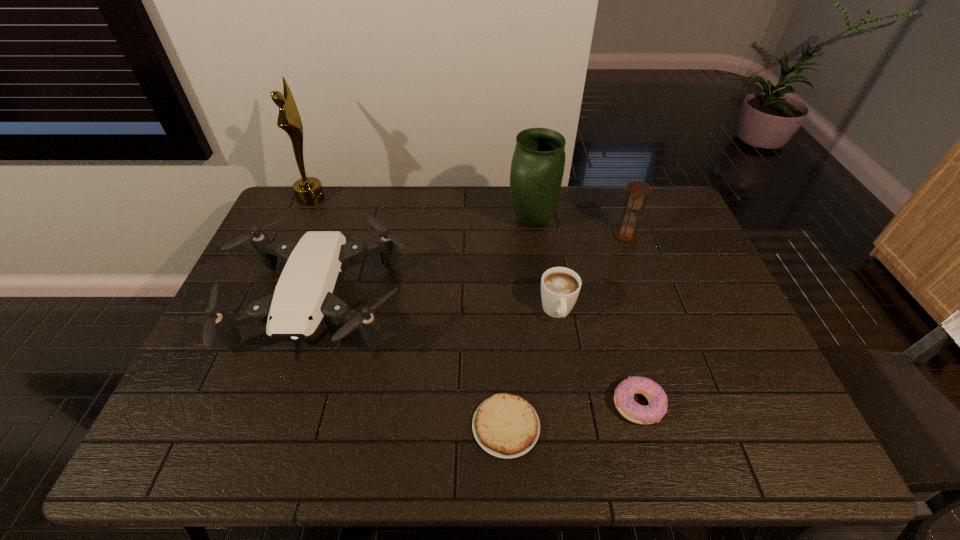
Locate an element on the screen. vacant space that's between the award and the tortilla is located at coordinates (409, 312).

Where is `unoccupied position between the vase and the second shortest object`? The height and width of the screenshot is (540, 960). unoccupied position between the vase and the second shortest object is located at coordinates (586, 313).

This screenshot has width=960, height=540. In order to click on empty location between the cappuccino and the vase in this screenshot , I will do `click(545, 266)`.

Identify the location of unoccupied position between the second object from right to left and the fourth shortest object. (479, 356).

At what (x,y) coordinates should I click in order to perform the action: click on vacant area that lies between the vase and the sixth object from left to right. Please return your answer as a coordinate pair (x, y). Looking at the image, I should click on (586, 313).

Locate an element on the screen. free space between the sixth shortest object and the second object from right to left is located at coordinates (586, 313).

Image resolution: width=960 pixels, height=540 pixels. In order to click on free space between the hourglass and the tortilla in this screenshot , I will do [x=565, y=331].

Where is `free spot between the vase and the shortest object`? free spot between the vase and the shortest object is located at coordinates (519, 323).

Image resolution: width=960 pixels, height=540 pixels. Find the location of `free space between the fifth tallest object and the fourth shortest object`. free space between the fifth tallest object and the fourth shortest object is located at coordinates (439, 310).

The width and height of the screenshot is (960, 540). I want to click on empty location between the hourglass and the tallest object, so click(468, 217).